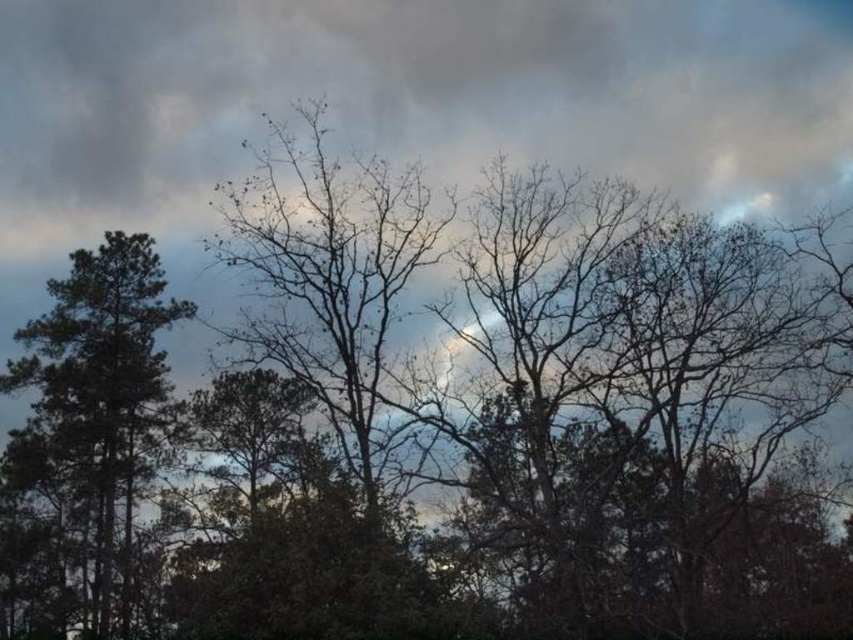
Between bare branches at center and green matte tree at left, which one is positioned lower?

green matte tree at left

Is bare branches at center shorter than green matte tree at left?

In fact, bare branches at center may be taller than green matte tree at left.

Does point (350, 188) come behind point (161, 376)?

No, it is in front of (161, 376).

Locate an element on the screen. This screenshot has height=640, width=853. bare branches at center is located at coordinates (329, 275).